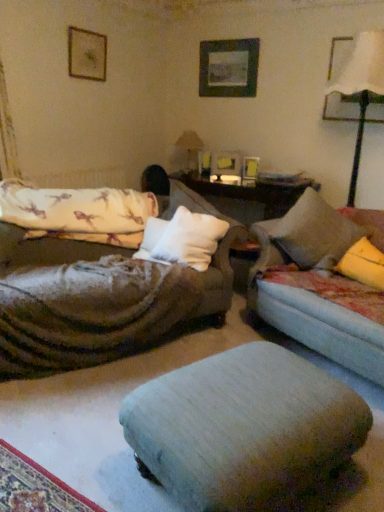
Question: Is light gray fabric footrest at center taller or shorter than white fabric lampshade at upper right, which appears as the second table lamp when viewed from the back?

Choices:
 (A) short
 (B) tall

Answer: (A)

Question: Considering the positions of light gray fabric footrest at center and white fabric lampshade at upper right, which appears as the second table lamp when viewed from the back, in the image, is light gray fabric footrest at center wider or thinner than white fabric lampshade at upper right, which appears as the second table lamp when viewed from the back,?

Choices:
 (A) thin
 (B) wide

Answer: (B)

Question: Which is farther from the fluffy white mattress at left?

Choices:
 (A) matte black picture frame at upper right, which appears as the 1th picture frame when viewed from the right
 (B) wooden picture frame at upper center, the third picture frame positioned from the left
 (C) white fabric lampshade at upper right, arranged as the 2th table lamp when viewed from the left
 (D) white soft cushion at center
 (E) wooden picture frame at upper left, the fourth picture frame viewed from the right

Answer: (A)

Question: Which is farther from the matte beige table lamp at center, the 2th table lamp from the front?

Choices:
 (A) matte black picture frame at upper right, which is the 4th picture frame in left-to-right order
 (B) light blue fabric couch at right
 (C) white soft cushion at center
 (D) wooden picture frame at upper center, which is the 2th picture frame in right-to-left order
 (E) wooden picture frame at center, which is the 3th picture frame from right to left

Answer: (B)